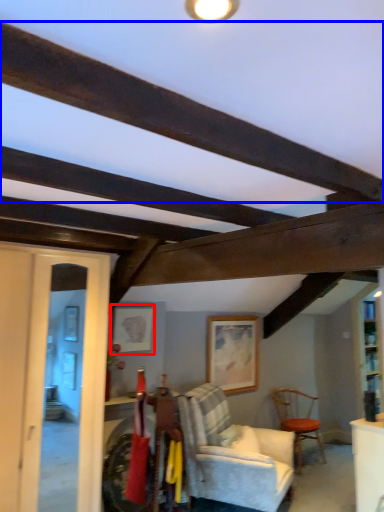
Question: Which object appears farthest to the camera in this image, picture frame (highlighted by a red box) or plank (highlighted by a blue box)?

Choices:
 (A) picture frame
 (B) plank

Answer: (A)